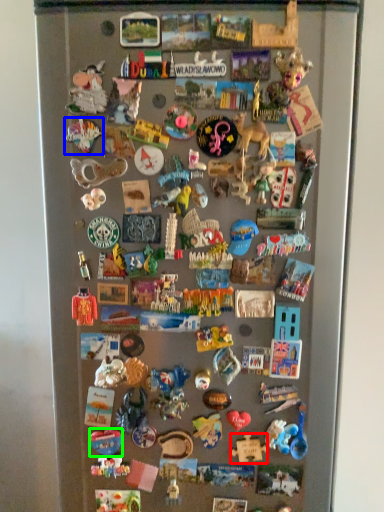
Question: Which is farther away from toy (highlighted by a red box)? toy (highlighted by a blue box) or toy (highlighted by a green box)?

Choices:
 (A) toy
 (B) toy

Answer: (A)